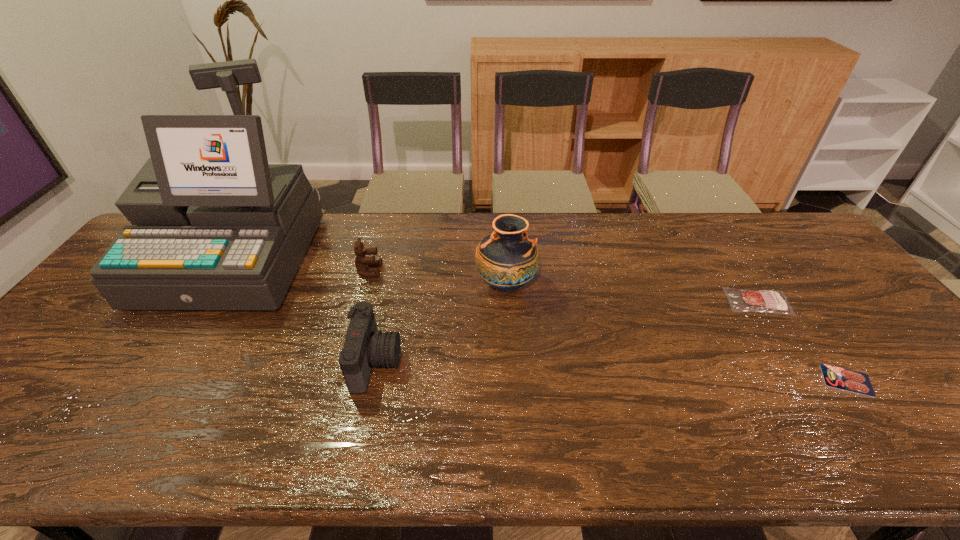
I want to click on free space that satisfies the following two spatial constraints: 1. on the face of the teddy bear; 2. on the left side of the fifth tallest object, so click(361, 302).